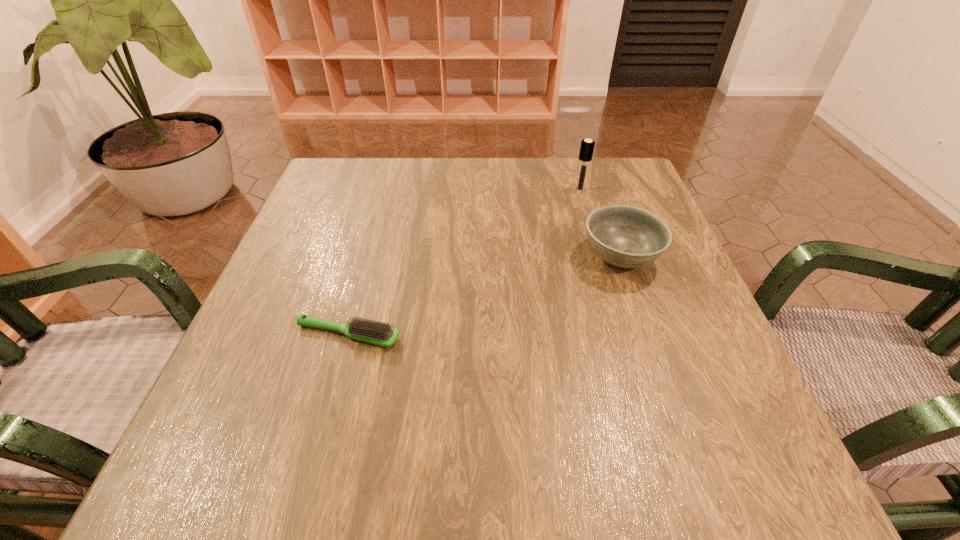
Locate an element on the screen. This screenshot has width=960, height=540. object that is at the left edge is located at coordinates (376, 332).

The width and height of the screenshot is (960, 540). Find the location of `hairbrush present at the right edge`. hairbrush present at the right edge is located at coordinates (587, 146).

Image resolution: width=960 pixels, height=540 pixels. In order to click on bowl situated at the right edge in this screenshot , I will do `click(624, 236)`.

At what (x,y) coordinates should I click in order to perform the action: click on object located in the far right corner section of the desktop. Please return your answer as a coordinate pair (x, y). This screenshot has height=540, width=960. Looking at the image, I should click on [x=587, y=146].

The image size is (960, 540). I want to click on vacant area at the far edge of the desktop, so click(470, 199).

Locate an element on the screen. vacant area at the near edge is located at coordinates (612, 463).

I want to click on blank area at the left edge, so click(261, 320).

In the image, there is a desktop. Where is `vacant space at the right edge`? The width and height of the screenshot is (960, 540). vacant space at the right edge is located at coordinates (646, 361).

Where is `vacant space at the far left corner of the desktop`? The image size is (960, 540). vacant space at the far left corner of the desktop is located at coordinates (372, 200).

Locate an element on the screen. This screenshot has height=540, width=960. free point at the near left corner is located at coordinates (245, 434).